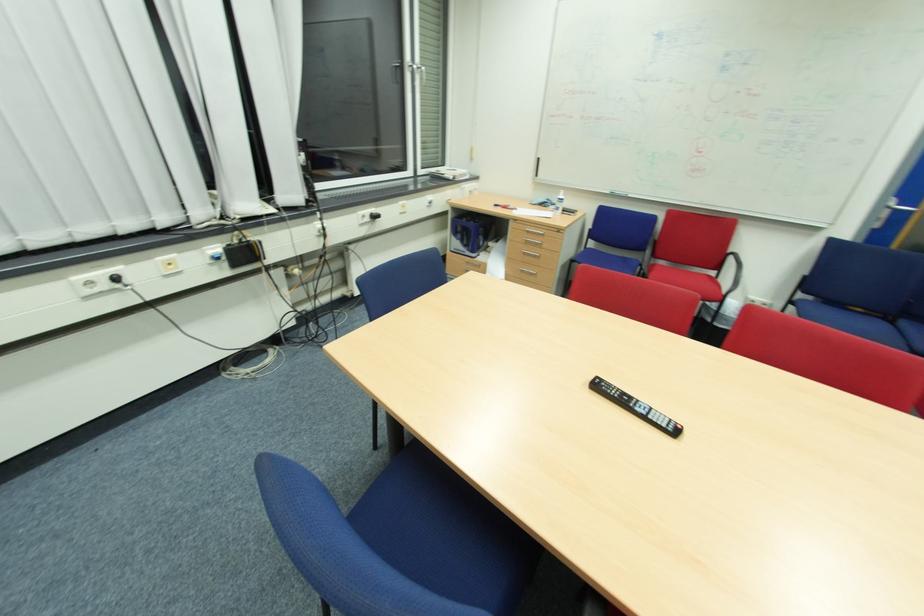
Locate an element on the screen. The height and width of the screenshot is (616, 924). the left blue sofa sitting surface is located at coordinates (604, 260).